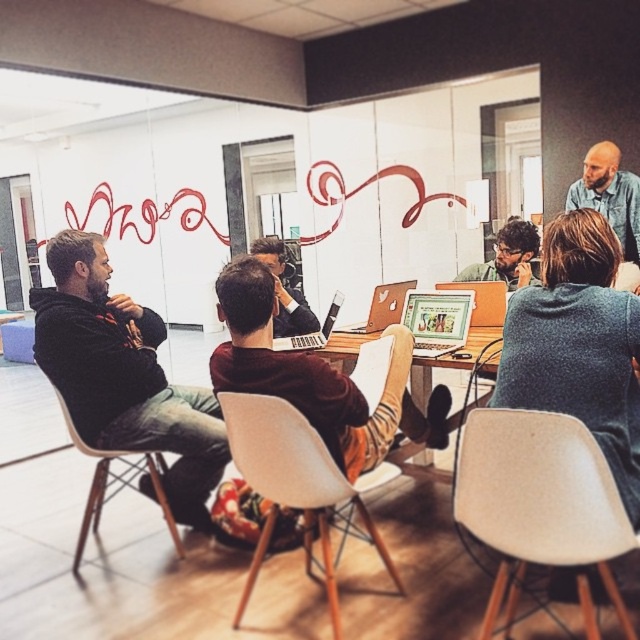
Question: Which point is closer to the camera?

Choices:
 (A) matte brown laptop at center
 (B) brown leather jacket at center

Answer: (B)

Question: Can you confirm if white plastic chair at lower right is wider than white plastic chair at left?

Choices:
 (A) no
 (B) yes

Answer: (A)

Question: Which of the following is the farthest from the observer?

Choices:
 (A) (317, 323)
 (B) (396, 310)

Answer: (A)

Question: Does denim jacket at upper right have a greater width compared to matte black laptop at center?

Choices:
 (A) no
 (B) yes

Answer: (B)

Question: Is matte brown hair at center to the left of matte brown laptop at center from the viewer's perspective?

Choices:
 (A) no
 (B) yes

Answer: (A)

Question: Which object is positioned farthest from the white plastic chair at lower right?

Choices:
 (A) matte brown laptop at center
 (B) white plastic chair at left
 (C) matte black laptop at center

Answer: (B)